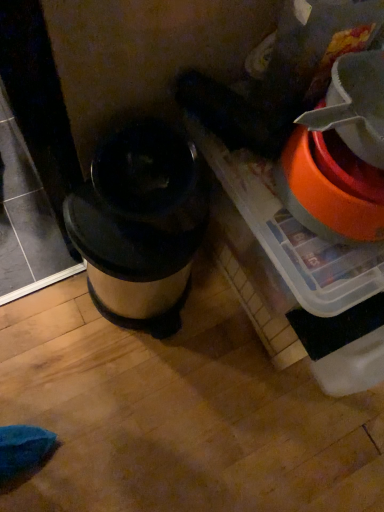
Locate an element on the screen. Image resolution: width=384 pixels, height=512 pixels. free space to the left of metallic silver trash can at center is located at coordinates (42, 284).